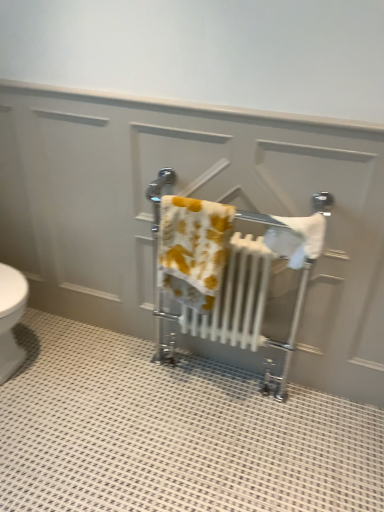
The width and height of the screenshot is (384, 512). I want to click on white metallic towel rack at center, so (x=157, y=258).

Measure the distance between point (x=282, y=380) and camera.

They are 6.29 feet apart.

The width and height of the screenshot is (384, 512). What do you see at coordinates (297, 238) in the screenshot?
I see `white cotton towel at center, which is counted as the 1th bath towel, starting from the right` at bounding box center [297, 238].

Where is `yellow printed towel at center, the 1th bath towel positioned from the left`? yellow printed towel at center, the 1th bath towel positioned from the left is located at coordinates point(193,249).

From the image's perspective, would you say yellow printed towel at center, marked as the 2th bath towel in a right-to-left arrangement, is positioned over white cotton towel at center, the second bath towel viewed from the left?

Incorrect, from the image's perspective, yellow printed towel at center, marked as the 2th bath towel in a right-to-left arrangement, is lower than white cotton towel at center, the second bath towel viewed from the left.

Considering the sizes of yellow printed towel at center, the 1th bath towel positioned from the left, and white cotton towel at center, which is counted as the 1th bath towel, starting from the right, in the image, is yellow printed towel at center, the 1th bath towel positioned from the left, bigger or smaller than white cotton towel at center, which is counted as the 1th bath towel, starting from the right,?

In the image, yellow printed towel at center, the 1th bath towel positioned from the left, appears to be larger than white cotton towel at center, which is counted as the 1th bath towel, starting from the right.

Is yellow printed towel at center, marked as the 2th bath towel in a right-to-left arrangement, surrounding white cotton towel at center, the second bath towel viewed from the left?

Definitely not — white cotton towel at center, the second bath towel viewed from the left, is not inside yellow printed towel at center, marked as the 2th bath towel in a right-to-left arrangement.

Does white metallic towel rack at center come in front of white cotton towel at center, which is counted as the 1th bath towel, starting from the right?

No, the depth of white metallic towel rack at center is greater than that of white cotton towel at center, which is counted as the 1th bath towel, starting from the right.

From a real-world perspective, is white metallic towel rack at center positioned over white cotton towel at center, which is counted as the 1th bath towel, starting from the right, based on gravity?

No, from a real-world perspective, white metallic towel rack at center is not above white cotton towel at center, which is counted as the 1th bath towel, starting from the right.

Looking at this image, is white metallic towel rack at center with white cotton towel at center, which is counted as the 1th bath towel, starting from the right?

No, white metallic towel rack at center is not touching white cotton towel at center, which is counted as the 1th bath towel, starting from the right.

From the image's perspective, is white metallic towel rack at center above or below white cotton towel at center, the second bath towel viewed from the left?

From the image's perspective, white metallic towel rack at center appears below white cotton towel at center, the second bath towel viewed from the left.

Considering the positions of objects white metallic towel rack at center and yellow printed towel at center, the 1th bath towel positioned from the left, in the image provided, who is more to the right, white metallic towel rack at center or yellow printed towel at center, the 1th bath towel positioned from the left,?

Positioned to the right is white metallic towel rack at center.

Considering the sizes of white metallic towel rack at center and yellow printed towel at center, the 1th bath towel positioned from the left, in the image, is white metallic towel rack at center taller or shorter than yellow printed towel at center, the 1th bath towel positioned from the left,?

white metallic towel rack at center is taller than yellow printed towel at center, the 1th bath towel positioned from the left.

Is white metallic towel rack at center far away from yellow printed towel at center, marked as the 2th bath towel in a right-to-left arrangement?

That's not correct — white metallic towel rack at center is a little close to yellow printed towel at center, marked as the 2th bath towel in a right-to-left arrangement.

Between point (206, 294) and point (164, 352), which one is positioned in front?

The point (206, 294) is in front.

In terms of height, does yellow printed towel at center, marked as the 2th bath towel in a right-to-left arrangement, look taller or shorter compared to white metallic towel rack at center?

Considering their sizes, yellow printed towel at center, marked as the 2th bath towel in a right-to-left arrangement, has less height than white metallic towel rack at center.

Does yellow printed towel at center, the 1th bath towel positioned from the left, have a smaller size compared to white metallic towel rack at center?

Yes, yellow printed towel at center, the 1th bath towel positioned from the left, is smaller than white metallic towel rack at center.

How many degrees apart are the facing directions of yellow printed towel at center, the 1th bath towel positioned from the left, and white metallic towel rack at center?

The facing directions of yellow printed towel at center, the 1th bath towel positioned from the left, and white metallic towel rack at center are 0.00114 degrees apart.

Is white cotton towel at center, which is counted as the 1th bath towel, starting from the right, at the left side of white metallic towel rack at center?

Incorrect, white cotton towel at center, which is counted as the 1th bath towel, starting from the right, is not on the left side of white metallic towel rack at center.

From the image's perspective, which one is positioned lower, white cotton towel at center, the second bath towel viewed from the left, or white metallic towel rack at center?

From the image's view, white metallic towel rack at center is below.

Is white cotton towel at center, the second bath towel viewed from the left, beside white metallic towel rack at center?

No, white cotton towel at center, the second bath towel viewed from the left, is not beside white metallic towel rack at center.

Considering the points (289, 227) and (159, 203), which point is behind, point (289, 227) or point (159, 203)?

Point (159, 203)

Does white cotton towel at center, which is counted as the 1th bath towel, starting from the right, appear on the left side of yellow printed towel at center, the 1th bath towel positioned from the left?

Incorrect, white cotton towel at center, which is counted as the 1th bath towel, starting from the right, is not on the left side of yellow printed towel at center, the 1th bath towel positioned from the left.

Considering the sizes of objects white cotton towel at center, which is counted as the 1th bath towel, starting from the right, and yellow printed towel at center, the 1th bath towel positioned from the left, in the image provided, who is smaller, white cotton towel at center, which is counted as the 1th bath towel, starting from the right, or yellow printed towel at center, the 1th bath towel positioned from the left,?

white cotton towel at center, which is counted as the 1th bath towel, starting from the right, is smaller.

Between point (312, 248) and point (181, 231), which one is positioned behind?

The point (181, 231) is more distant.

From the picture: Can you tell me how much white cotton towel at center, the second bath towel viewed from the left, and yellow printed towel at center, marked as the 2th bath towel in a right-to-left arrangement, differ in facing direction?

There is a 0.00113-degree angle between the facing directions of white cotton towel at center, the second bath towel viewed from the left, and yellow printed towel at center, marked as the 2th bath towel in a right-to-left arrangement.

Find the location of a particular element. This screenshot has width=384, height=512. bath towel positioned vertically above the yellow printed towel at center, the 1th bath towel positioned from the left (from a real-world perspective) is located at coordinates (297, 238).

Where is `baby carriage on the left of white cotton towel at center, the second bath towel viewed from the left`? The height and width of the screenshot is (512, 384). baby carriage on the left of white cotton towel at center, the second bath towel viewed from the left is located at coordinates (157, 258).

Estimate the real-world distances between objects in this image. Which object is closer to white cotton towel at center, the second bath towel viewed from the left, yellow printed towel at center, the 1th bath towel positioned from the left, or white metallic towel rack at center?

Based on the image, white metallic towel rack at center appears to be nearer to white cotton towel at center, the second bath towel viewed from the left.

From the image, which object appears to be farther from white cotton towel at center, the second bath towel viewed from the left, white metallic towel rack at center or yellow printed towel at center, the 1th bath towel positioned from the left?

Among the two, yellow printed towel at center, the 1th bath towel positioned from the left, is located further to white cotton towel at center, the second bath towel viewed from the left.

From the picture: Which object lies further to the anchor point yellow printed towel at center, the 1th bath towel positioned from the left, white cotton towel at center, the second bath towel viewed from the left, or white metallic towel rack at center?

white cotton towel at center, the second bath towel viewed from the left, is further to yellow printed towel at center, the 1th bath towel positioned from the left.

Which object lies further to the anchor point white metallic towel rack at center, white cotton towel at center, the second bath towel viewed from the left, or yellow printed towel at center, marked as the 2th bath towel in a right-to-left arrangement?

Among the two, yellow printed towel at center, marked as the 2th bath towel in a right-to-left arrangement, is located further to white metallic towel rack at center.

Estimate the real-world distances between objects in this image. Which object is further from white metallic towel rack at center, yellow printed towel at center, marked as the 2th bath towel in a right-to-left arrangement, or white cotton towel at center, which is counted as the 1th bath towel, starting from the right?

Among the two, yellow printed towel at center, marked as the 2th bath towel in a right-to-left arrangement, is located further to white metallic towel rack at center.

From the picture: When comparing their distances from yellow printed towel at center, marked as the 2th bath towel in a right-to-left arrangement, does white metallic towel rack at center or white cotton towel at center, which is counted as the 1th bath towel, starting from the right, seem further?

Based on the image, white cotton towel at center, which is counted as the 1th bath towel, starting from the right, appears to be further to yellow printed towel at center, marked as the 2th bath towel in a right-to-left arrangement.

The height and width of the screenshot is (512, 384). Identify the location of baby carriage between yellow printed towel at center, the 1th bath towel positioned from the left, and white cotton towel at center, which is counted as the 1th bath towel, starting from the right. (157, 258).